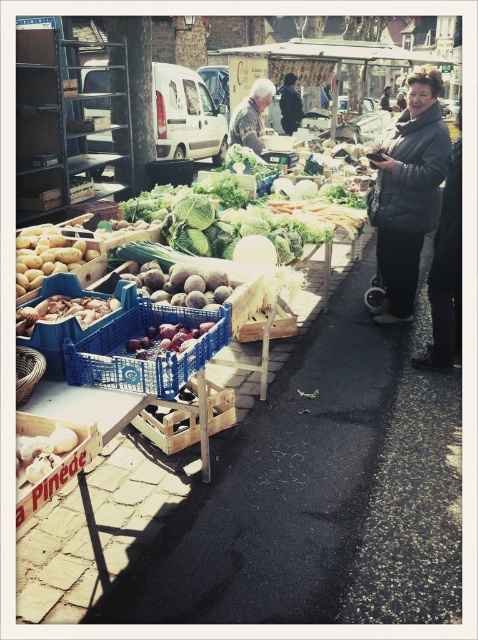
Who is higher up, dark gray puffer jacket at right or blue plastic crate at center?

dark gray puffer jacket at right is above.

Find the location of a particular element. The height and width of the screenshot is (640, 478). dark gray puffer jacket at right is located at coordinates (408, 193).

Between dark gray textured coat at right and leather jacket at center, which one has more height?

leather jacket at center

Does dark gray textured coat at right have a larger size compared to leather jacket at center?

No.

Does point (448, 268) come behind point (262, 81)?

That is False.

Locate an element on the screen. The height and width of the screenshot is (640, 478). dark gray textured coat at right is located at coordinates (445, 272).

Does blue plastic crate at center appear over dark gray jacket at center?

Actually, blue plastic crate at center is below dark gray jacket at center.

Where is `blue plastic crate at center`? The width and height of the screenshot is (478, 640). blue plastic crate at center is located at coordinates (147, 349).

This screenshot has height=640, width=478. Describe the element at coordinates (147, 349) in the screenshot. I see `blue plastic crate at center` at that location.

The width and height of the screenshot is (478, 640). What are the coordinates of `blue plastic crate at center` in the screenshot? It's located at (147, 349).